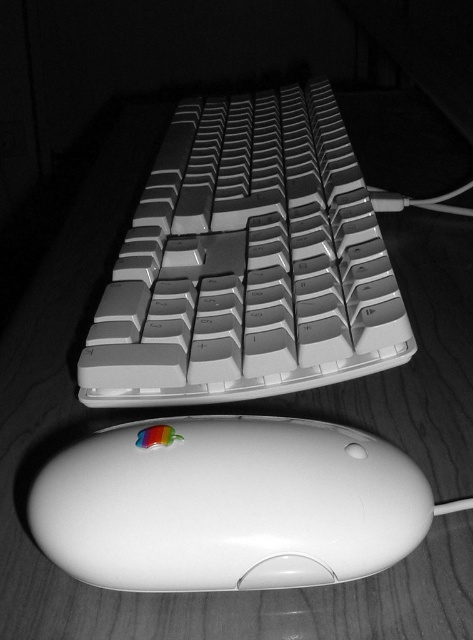
You are organizing a tech exhibit and need to place a label on the wooden surface between the white plastic keyboard at center and the white glossy mouse at lower center. Can you fit the label there?

The white plastic keyboard at center is located above the white glossy mouse at lower center, so there is space between them on the wooden surface where you can place the label.

You are setting up a display for a tech exhibition and need to place the white plastic keyboard at center and the white glossy mouse at lower center. According to the image, which object is positioned behind the other?

The white glossy mouse at lower center is behind the white plastic keyboard at center.